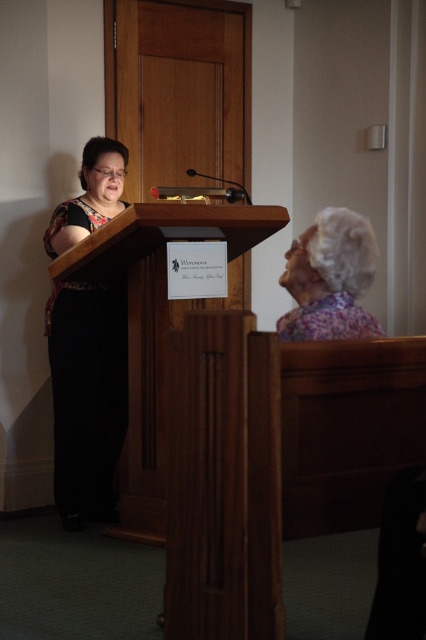
Question: Which object is positioned closest to the floral fabric headscarf at upper right?

Choices:
 (A) floral fabric dress at left
 (B) wooden podium at center

Answer: (B)

Question: From the image, what is the correct spatial relationship of wooden podium at center in relation to floral fabric headscarf at upper right?

Choices:
 (A) below
 (B) above

Answer: (A)

Question: Does floral fabric dress at left have a lesser width compared to floral fabric headscarf at upper right?

Choices:
 (A) no
 (B) yes

Answer: (A)

Question: Is floral fabric dress at left closer to the viewer compared to floral fabric headscarf at upper right?

Choices:
 (A) yes
 (B) no

Answer: (B)

Question: Considering the real-world distances, which object is closest to the floral fabric dress at left?

Choices:
 (A) wooden podium at center
 (B) floral fabric headscarf at upper right

Answer: (A)

Question: Which object is closer to the camera taking this photo?

Choices:
 (A) floral fabric headscarf at upper right
 (B) wooden podium at center
 (C) floral fabric dress at left

Answer: (A)